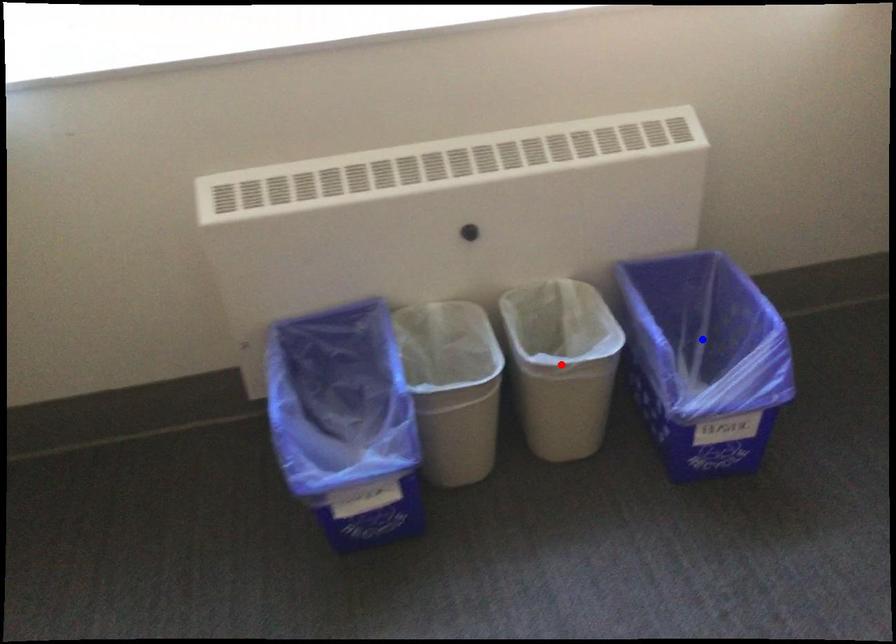
Question: Two points are marked on the image. Which point is closer to the camera?

Choices:
 (A) Blue point is closer.
 (B) Red point is closer.

Answer: (B)